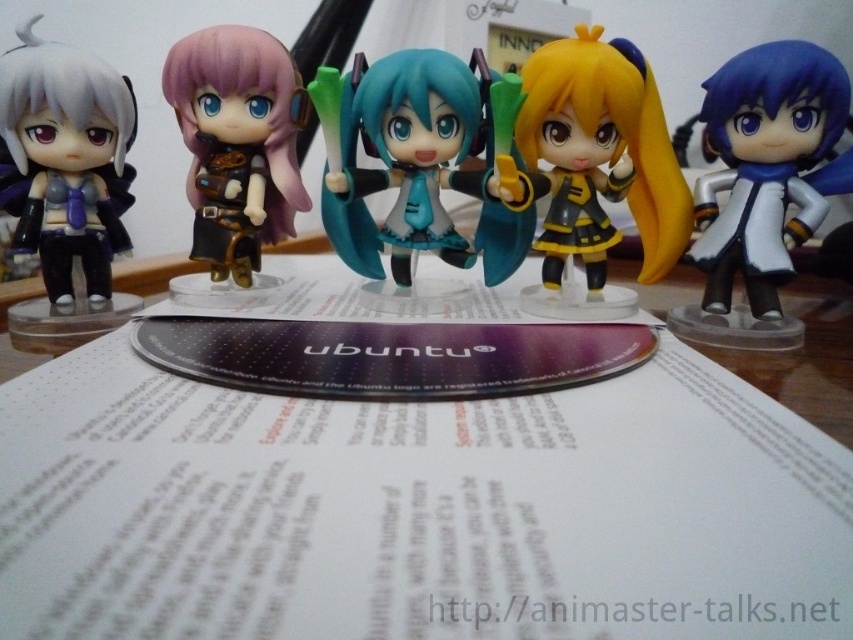
Consider the image. Can you confirm if white paper at center is positioned below white glossy figure at right?

Yes, white paper at center is below white glossy figure at right.

The image size is (853, 640). What do you see at coordinates (416, 509) in the screenshot?
I see `white paper at center` at bounding box center [416, 509].

You are a GUI agent. You are given a task and a screenshot of the screen. Output one action in this format:
    pyautogui.click(x=<x>, y=<y>)
    Task: Click on the white paper at center
    This screenshot has height=640, width=853.
    Given the screenshot: What is the action you would take?
    pyautogui.click(x=416, y=509)

Which of these two, white glossy figure at right or matte black figure at left, stands taller?

With more height is white glossy figure at right.

Where is `white glossy figure at right`? The height and width of the screenshot is (640, 853). white glossy figure at right is located at coordinates (759, 186).

Does point (753, 291) come behind point (51, 225)?

No.

At what (x,y) coordinates should I click in order to perform the action: click on white glossy figure at right. Please return your answer as a coordinate pair (x, y). This screenshot has height=640, width=853. Looking at the image, I should click on (759, 186).

Is point (672, 259) positioned in front of point (786, 72)?

No.

Does point (599, 182) come closer to viewer compared to point (802, 150)?

No, it is behind (802, 150).

I want to click on yellow matte figure at center, so click(x=595, y=170).